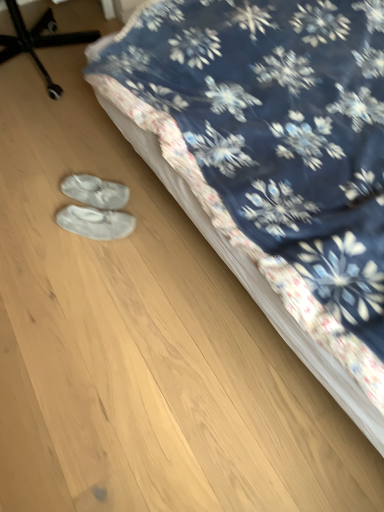
At what (x,y) coordinates should I click in order to perform the action: click on vacant area in front of black plastic chair at upper left. Please return your answer as a coordinate pair (x, y). The image size is (384, 512). Looking at the image, I should click on (55, 142).